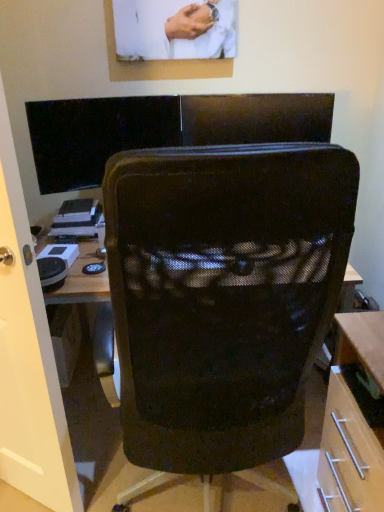
Question: Can you confirm if black mesh chair at center is taller than black glossy monitor at upper left?

Choices:
 (A) no
 (B) yes

Answer: (B)

Question: Is black mesh chair at center far away from black glossy monitor at upper left?

Choices:
 (A) no
 (B) yes

Answer: (B)

Question: Is black mesh chair at center bigger than black glossy monitor at upper left?

Choices:
 (A) no
 (B) yes

Answer: (B)

Question: Does black mesh chair at center have a lesser width compared to black glossy monitor at upper left?

Choices:
 (A) yes
 (B) no

Answer: (B)

Question: Does black mesh chair at center appear on the left side of black glossy monitor at upper left?

Choices:
 (A) yes
 (B) no

Answer: (B)

Question: From the image's perspective, does black mesh chair at center appear higher than black glossy monitor at upper left?

Choices:
 (A) yes
 (B) no

Answer: (B)

Question: Is black glossy monitor at upper left positioned in front of transparent glass door at left?

Choices:
 (A) yes
 (B) no

Answer: (B)

Question: Considering the relative sizes of black glossy monitor at upper left and transparent glass door at left in the image provided, is black glossy monitor at upper left taller than transparent glass door at left?

Choices:
 (A) no
 (B) yes

Answer: (A)

Question: From a real-world perspective, is black glossy monitor at upper left over transparent glass door at left?

Choices:
 (A) yes
 (B) no

Answer: (A)

Question: From the image's perspective, is black glossy monitor at upper left below transparent glass door at left?

Choices:
 (A) no
 (B) yes

Answer: (A)

Question: Can you confirm if black glossy monitor at upper left is wider than transparent glass door at left?

Choices:
 (A) no
 (B) yes

Answer: (A)

Question: Is black glossy monitor at upper left shorter than transparent glass door at left?

Choices:
 (A) no
 (B) yes

Answer: (B)

Question: Is black glossy monitor at upper left bigger than black mesh chair at center?

Choices:
 (A) no
 (B) yes

Answer: (A)